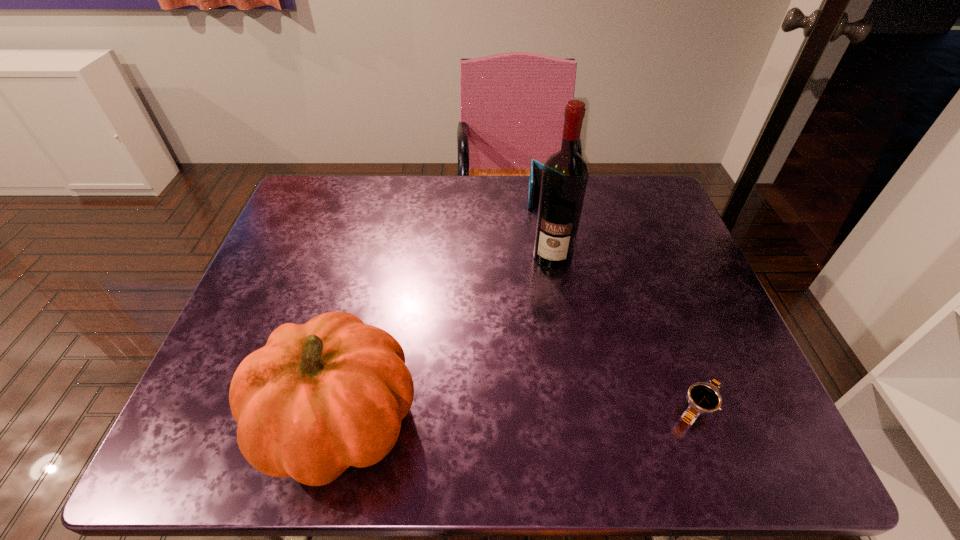
Find the location of a particular element. empty space between the farthest object and the third shortest object is located at coordinates (442, 309).

This screenshot has width=960, height=540. Identify the location of vacant point located between the pumpkin and the rightmost object. (518, 414).

Identify the location of free spot between the wallet and the leftmost object. (442, 309).

In order to click on free area in between the rightmost object and the alcohol in this screenshot , I will do `click(625, 332)`.

Where is `unoccupied area between the leftmost object and the rightmost object`? unoccupied area between the leftmost object and the rightmost object is located at coordinates (518, 414).

Locate an element on the screen. This screenshot has height=540, width=960. the third closest object to the second shortest object is located at coordinates (703, 397).

Find the location of `the third closest object relative to the second farthest object`. the third closest object relative to the second farthest object is located at coordinates (319, 397).

You are a GUI agent. You are given a task and a screenshot of the screen. Output one action in this format:
    pyautogui.click(x=<x>, y=<y>)
    Task: Click on the free space that satisfies the following two spatial constraints: 1. on the back side of the farthest object; 2. on the left side of the alcohol
    Image resolution: width=960 pixels, height=540 pixels.
    Given the screenshot: What is the action you would take?
    pyautogui.click(x=542, y=198)

Locate an element on the screen. The image size is (960, 540). free space that satisfies the following two spatial constraints: 1. on the back side of the farthest object; 2. on the right side of the pumpkin is located at coordinates (392, 198).

Locate an element on the screen. This screenshot has height=540, width=960. free location that satisfies the following two spatial constraints: 1. on the back side of the leftmost object; 2. on the left side of the farthest object is located at coordinates (392, 198).